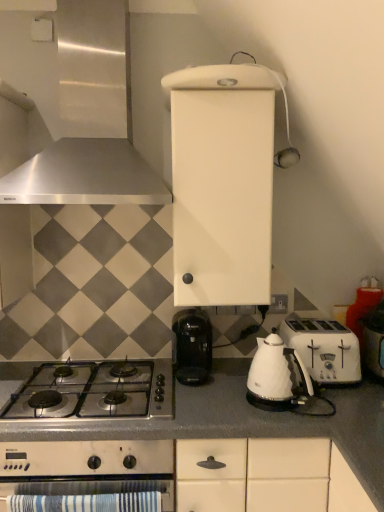
Identify the location of free space above gray matte countertop at lower center (from a real-world perspective). (194, 397).